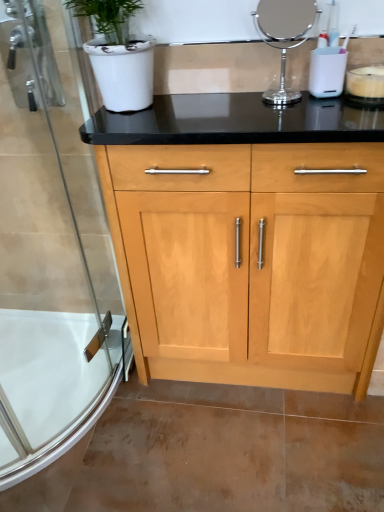
Where is `vacant space in front of clear glass shower door at left`? The height and width of the screenshot is (512, 384). vacant space in front of clear glass shower door at left is located at coordinates (132, 461).